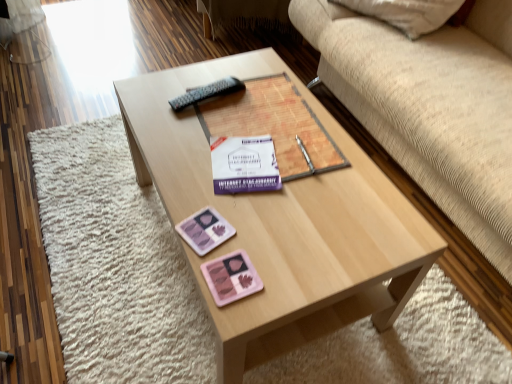
Find the location of a particular element. Image resolution: width=512 pixels, height=384 pixels. vacant space that's between white paper at center and pink matte eyeshadow palette at lower center, which is the second currency from top to bottom is located at coordinates (246, 223).